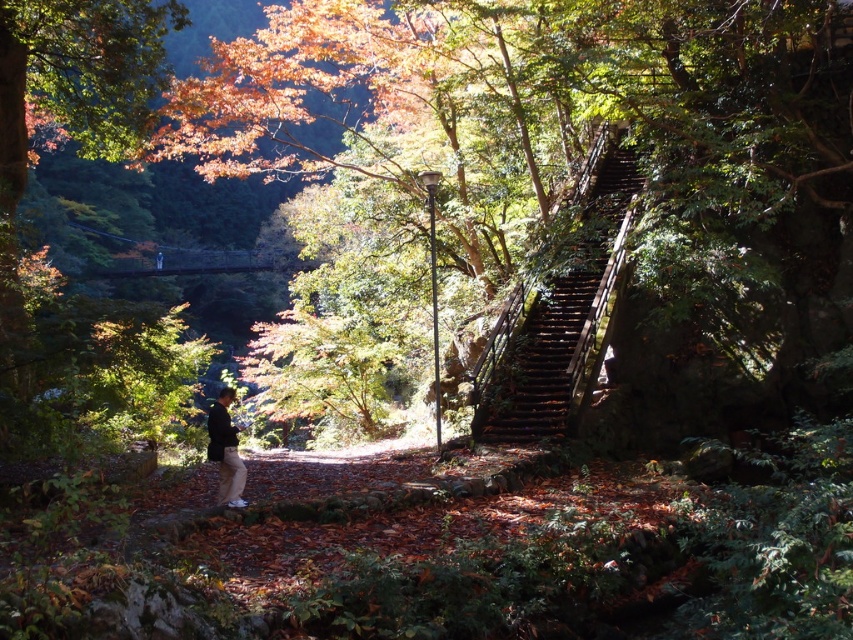
Question: Which point is closer to the camera taking this photo?

Choices:
 (A) (234, 508)
 (B) (517, 406)

Answer: (A)

Question: Which object appears farthest from the camera in this image?

Choices:
 (A) dark brown leather jacket at lower center
 (B) rusty wood stairs at right

Answer: (B)

Question: Can you confirm if rusty wood stairs at right is smaller than dark brown leather jacket at lower center?

Choices:
 (A) no
 (B) yes

Answer: (B)

Question: Which point appears farthest from the camera in this image?

Choices:
 (A) (509, 378)
 (B) (242, 484)

Answer: (A)

Question: Does rusty wood stairs at right lie behind dark brown leather jacket at lower center?

Choices:
 (A) yes
 (B) no

Answer: (A)

Question: In this image, where is rusty wood stairs at right located relative to dark brown leather jacket at lower center?

Choices:
 (A) left
 (B) right

Answer: (B)